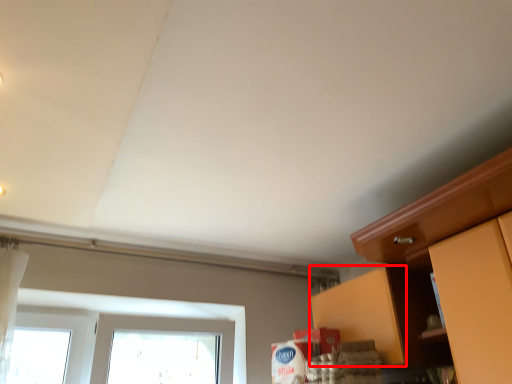
Question: In this image, where is cabinetry (annotated by the red box) located relative to cabinetry?

Choices:
 (A) left
 (B) right

Answer: (A)